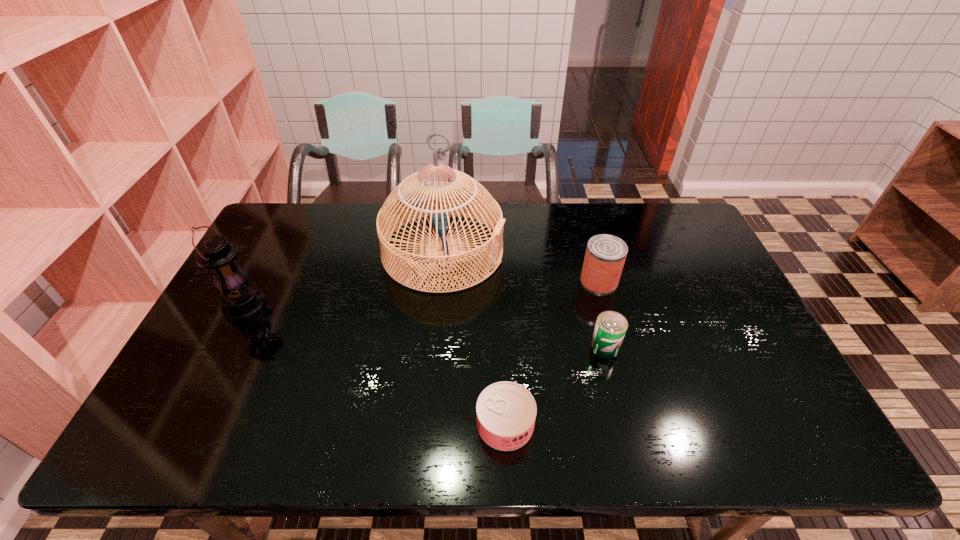
Where is `blank area in the image that satisfies the following two spatial constraints: 1. on the back side of the nearest can; 2. on the left side of the third tallest object`? The height and width of the screenshot is (540, 960). blank area in the image that satisfies the following two spatial constraints: 1. on the back side of the nearest can; 2. on the left side of the third tallest object is located at coordinates (499, 281).

Find the location of a particular element. Image resolution: width=960 pixels, height=540 pixels. free space in the image that satisfies the following two spatial constraints: 1. above the shortest object, indicating its light source; 2. on the right side of the fourth shortest object is located at coordinates (185, 424).

The image size is (960, 540). Find the location of `vacant space that satisfies the following two spatial constraints: 1. above the fourth shortest object, indicating its light source; 2. on the right side of the leftmost can`. vacant space that satisfies the following two spatial constraints: 1. above the fourth shortest object, indicating its light source; 2. on the right side of the leftmost can is located at coordinates (185, 424).

Locate an element on the screen. The width and height of the screenshot is (960, 540). free space in the image that satisfies the following two spatial constraints: 1. on the front side of the farthest can; 2. above the lantern, indicating its light source is located at coordinates (606, 305).